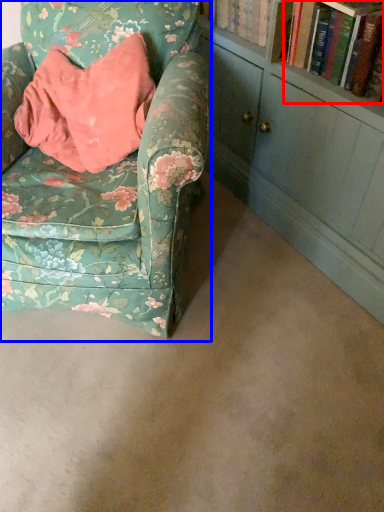
Question: Which point is further to the camera, book (highlighted by a red box) or chair (highlighted by a blue box)?

Choices:
 (A) book
 (B) chair

Answer: (A)